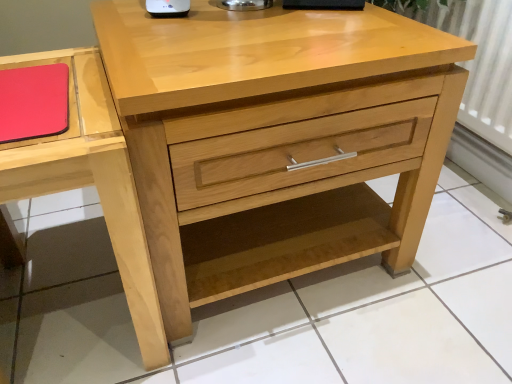
Image resolution: width=512 pixels, height=384 pixels. In order to click on empty space that is ontop of rubberized matte red notepad at upper left (from a real-world perspective) in this screenshot , I will do `click(31, 89)`.